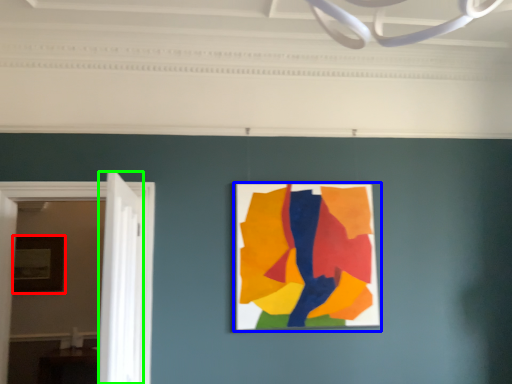
Question: Which is farther away from picture frame (highlighted by a red box)? picture frame (highlighted by a blue box) or door (highlighted by a green box)?

Choices:
 (A) picture frame
 (B) door

Answer: (A)